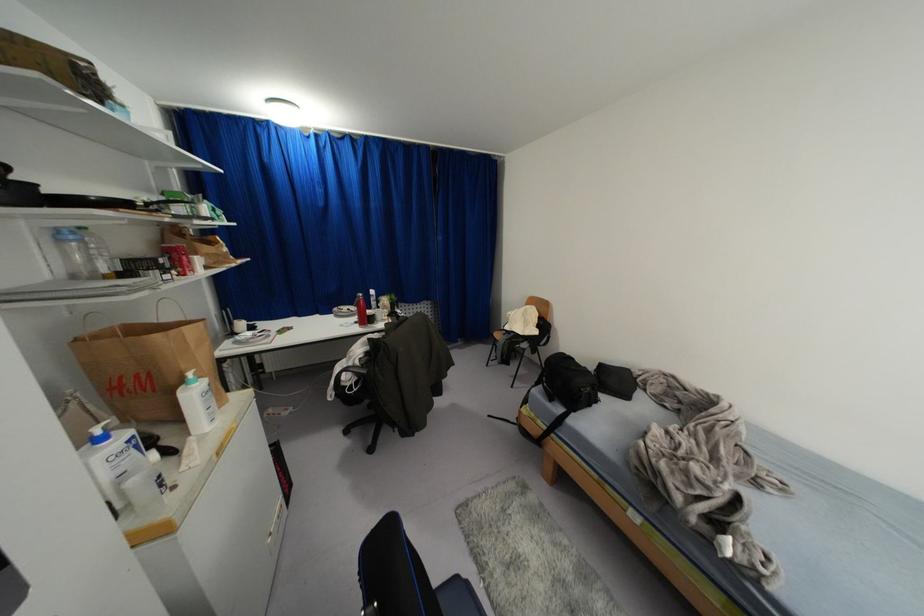
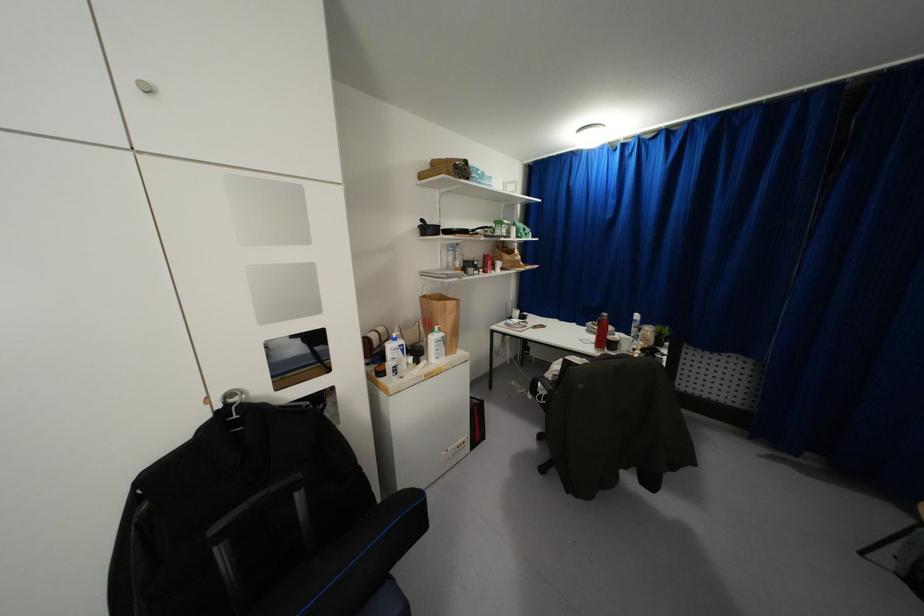
Locate, in the second image, the point that corresponds to point (155, 336) in the first image.

(434, 302)